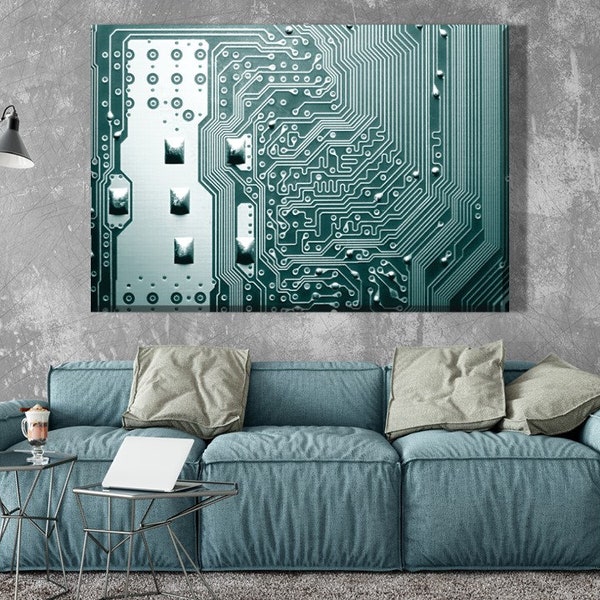
Identify the location of dinner tray. The height and width of the screenshot is (600, 600). (210, 485).